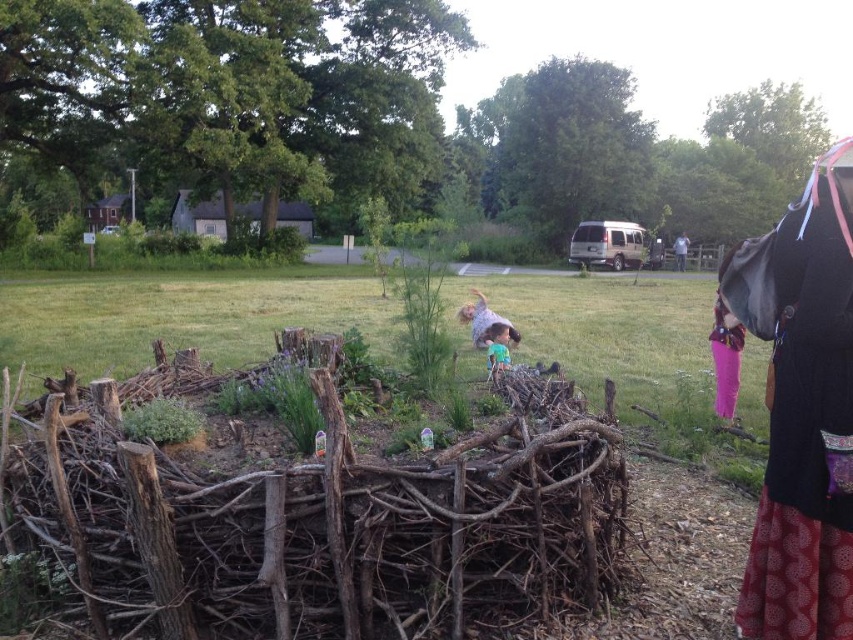
Is wooden hut at upper left thinner than pink fabric at lower right?

No.

Does wooden hut at upper left appear under pink fabric at lower right?

Actually, wooden hut at upper left is above pink fabric at lower right.

Where is `wooden hut at upper left`? wooden hut at upper left is located at coordinates [x=198, y=216].

This screenshot has height=640, width=853. In order to click on wooden hut at upper left in this screenshot , I will do `click(198, 216)`.

Is the position of wooden hut at upper left less distant than that of light blue shirt at center?

No, wooden hut at upper left is further to the viewer.

Describe the element at coordinates (198, 216) in the screenshot. I see `wooden hut at upper left` at that location.

Describe the element at coordinates (198, 216) in the screenshot. The image size is (853, 640). I see `wooden hut at upper left` at that location.

I want to click on wooden hut at upper left, so click(198, 216).

Is green leafy plant at center smaller than light blue shirt at center?

Yes.

Between point (138, 438) and point (479, 296), which one is positioned behind?

Positioned behind is point (479, 296).

Is point (163, 428) closer to viewer compared to point (476, 312)?

Yes, it is.

This screenshot has height=640, width=853. What are the coordinates of `green leafy plant at center` in the screenshot? It's located at (161, 420).